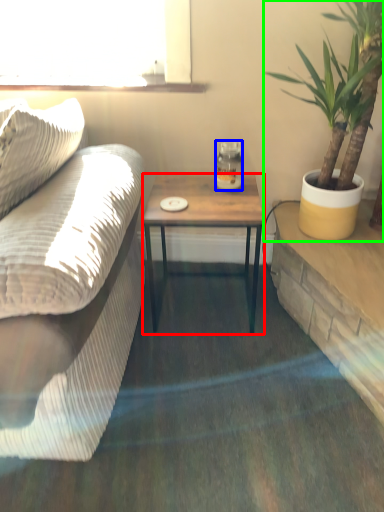
Question: Which object is positioned closest to coffee table (highlighted by a red box)? Select from coffee cup (highlighted by a blue box) and houseplant (highlighted by a green box).

Choices:
 (A) coffee cup
 (B) houseplant

Answer: (A)